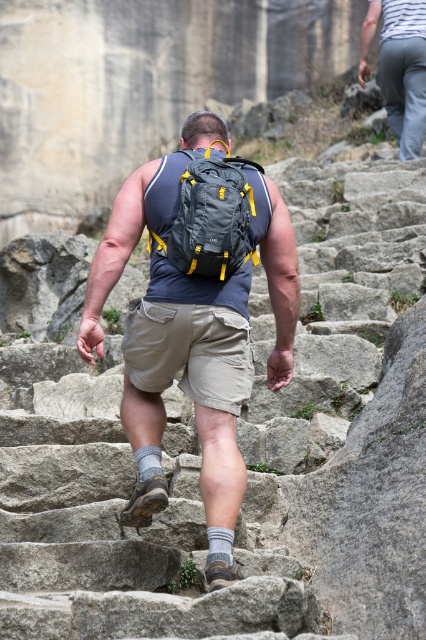
Question: Which point is farther to the camera?

Choices:
 (A) gray cotton pants at upper right
 (B) khaki cotton shorts at center

Answer: (A)

Question: Based on their relative distances, which object is nearer to the gray cotton pants at upper right?

Choices:
 (A) khaki cotton shorts at center
 (B) matte black backpack at center

Answer: (B)

Question: Is matte black backpack at center below gray fabric backpack at center?

Choices:
 (A) yes
 (B) no

Answer: (A)

Question: Can you confirm if matte black backpack at center is wider than gray fabric backpack at center?

Choices:
 (A) no
 (B) yes

Answer: (B)

Question: Which object is closer to the camera taking this photo?

Choices:
 (A) gray cotton pants at upper right
 (B) matte black backpack at center
 (C) gray fabric backpack at center

Answer: (B)

Question: Is matte black backpack at center to the right of gray fabric backpack at center from the viewer's perspective?

Choices:
 (A) no
 (B) yes

Answer: (B)